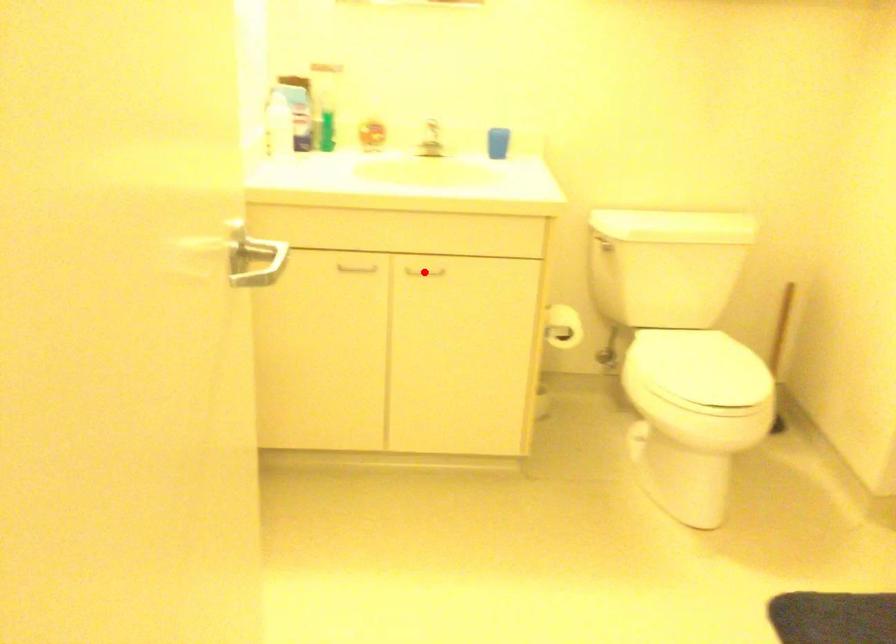
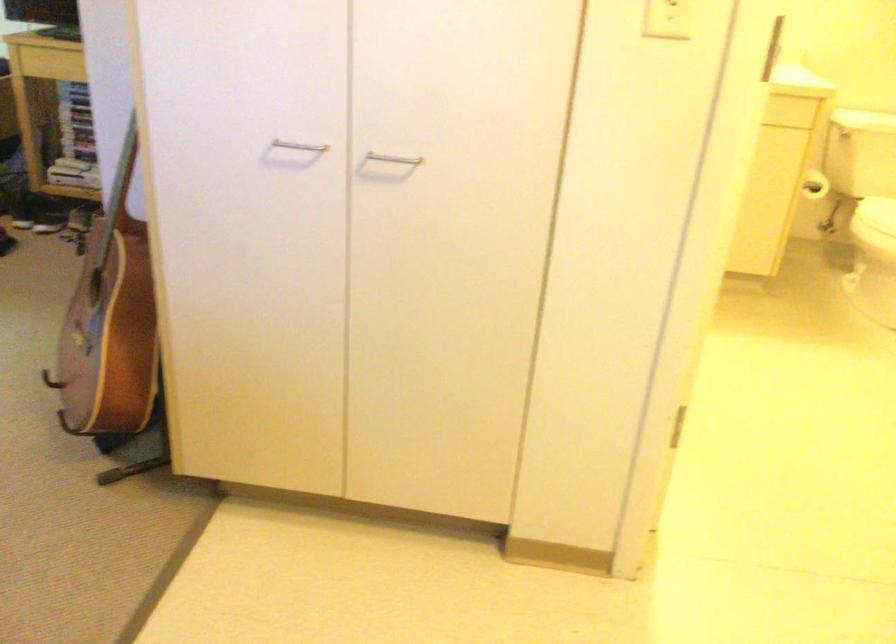
Question: I am providing you with two images of the same scene from different viewpoints. A red point is marked on the first image. Is the red point's position out of view in image 2?

Choices:
 (A) Yes
 (B) No

Answer: (A)